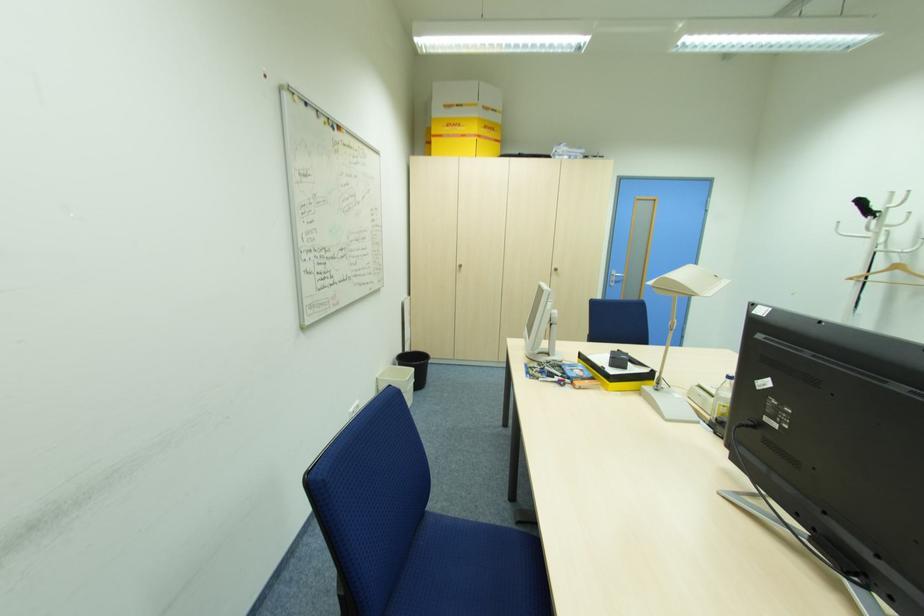
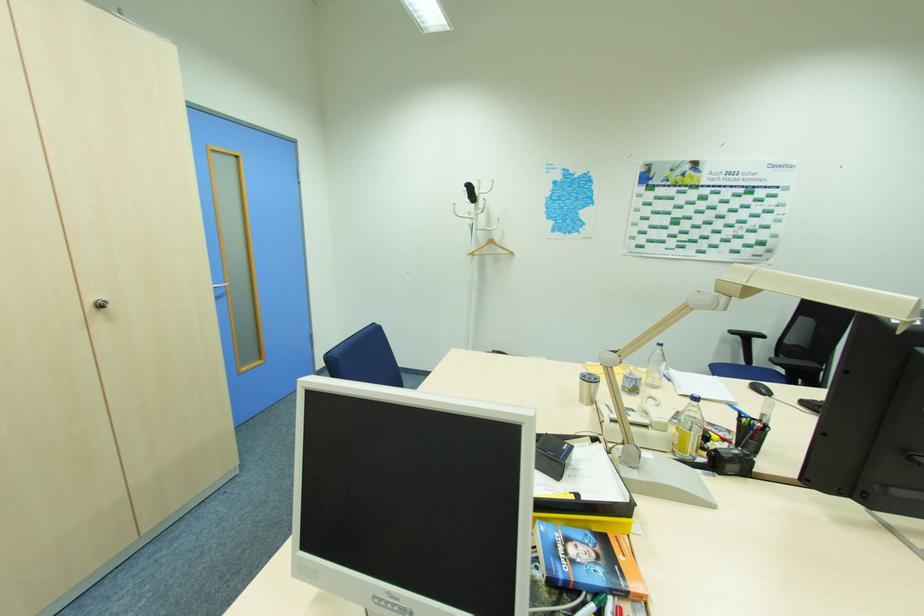
Locate, in the second image, the point that corresponds to [558,270] in the first image.

(103, 306)